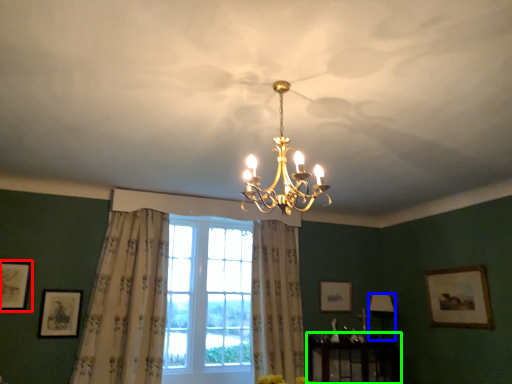
Question: Considering the real-world distances, which object is closest to picture frame (highlighted by a red box)? lamp (highlighted by a blue box) or furniture (highlighted by a green box).

Choices:
 (A) lamp
 (B) furniture

Answer: (B)